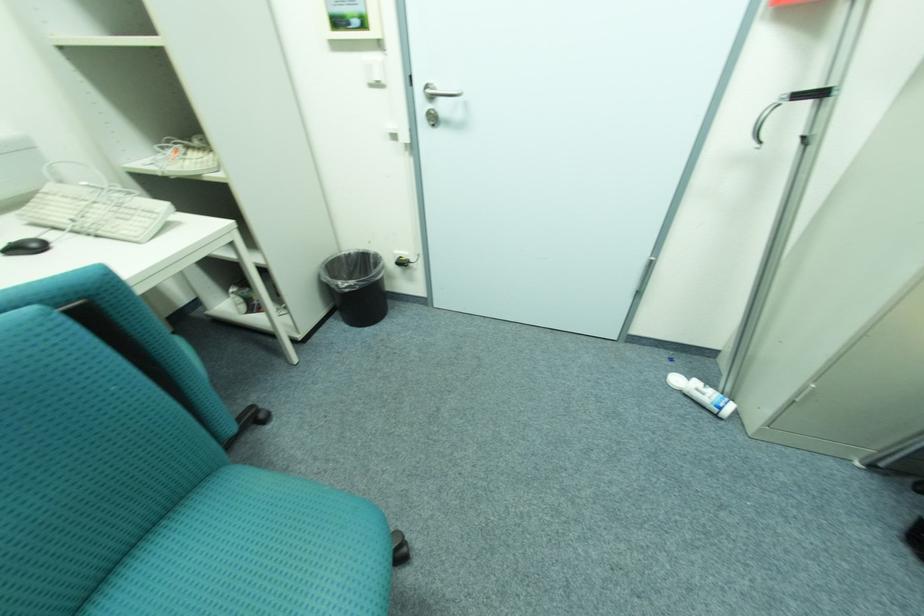
Where would you push the white light switch? Please return your answer as a coordinate pair (x, y).

(373, 71)